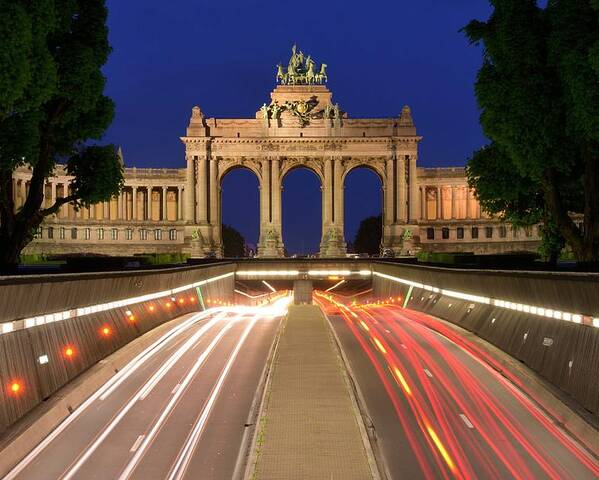
Image resolution: width=599 pixels, height=480 pixels. Identify the location of white lights. (223, 378).